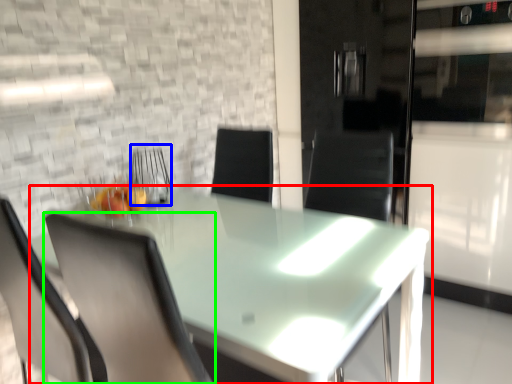
Question: Which is nearer to the table (highlighted by a red box)? armchair (highlighted by a blue box) or chair (highlighted by a green box).

Choices:
 (A) armchair
 (B) chair

Answer: (B)